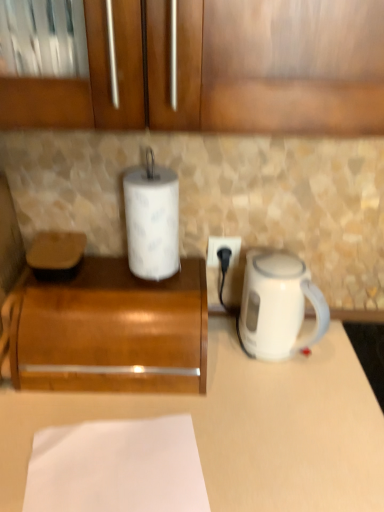
Find the location of a particular element. The height and width of the screenshot is (512, 384). free location to the left of white glossy electric kettle at right is located at coordinates (221, 352).